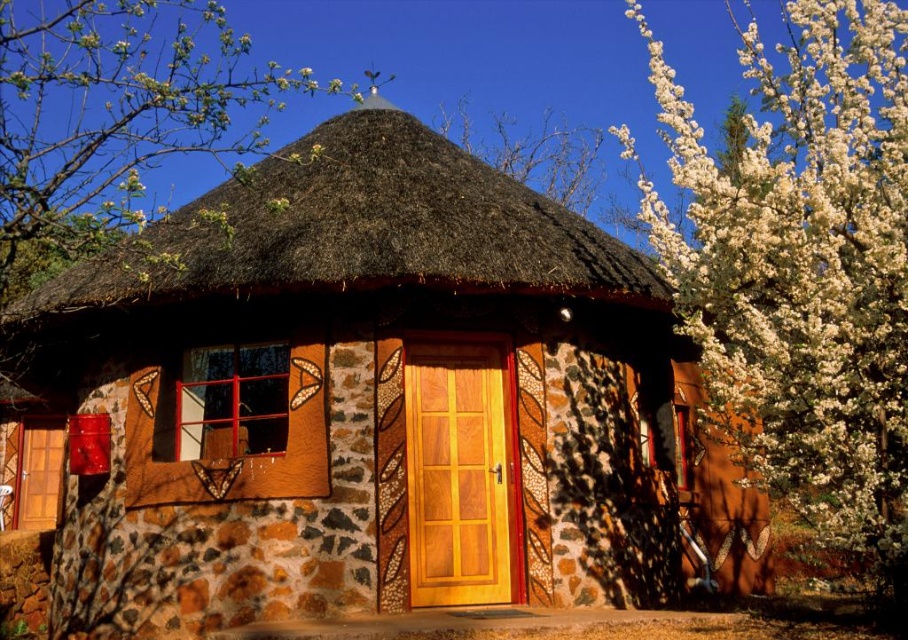
Who is higher up, rustic stone cottage at center or brown thatch at center?

brown thatch at center is higher up.

Who is more forward, (563, 374) or (210, 230)?

Positioned in front is point (210, 230).

Find the location of a particular element. The image size is (908, 640). rustic stone cottage at center is located at coordinates (373, 404).

Can you confirm if white fluffy petals at upper right is wider than brown thatch at center?

Yes.

Between white fluffy petals at upper right and brown thatch at center, which one is positioned higher?

Positioned higher is white fluffy petals at upper right.

The image size is (908, 640). Identify the location of white fluffy petals at upper right. (803, 266).

Which is more to the left, rustic stone cottage at center or white fluffy petals at upper right?

From the viewer's perspective, rustic stone cottage at center appears more on the left side.

Is rustic stone cottage at center to the right of white fluffy petals at upper right from the viewer's perspective?

No, rustic stone cottage at center is not to the right of white fluffy petals at upper right.

This screenshot has height=640, width=908. Describe the element at coordinates (373, 404) in the screenshot. I see `rustic stone cottage at center` at that location.

The width and height of the screenshot is (908, 640). Identify the location of rustic stone cottage at center. (373, 404).